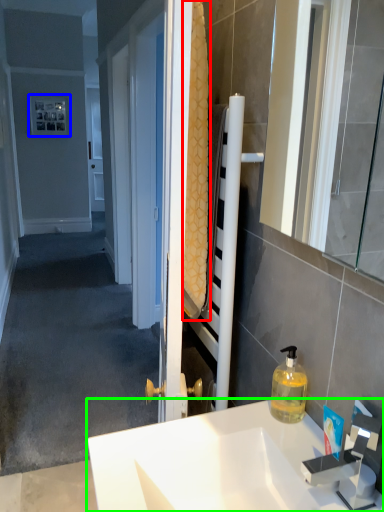
Question: Based on their relative distances, which object is farther from bath towel (highlighted by a red box)? Choose from picture frame (highlighted by a blue box) and sink (highlighted by a green box).

Choices:
 (A) picture frame
 (B) sink

Answer: (A)